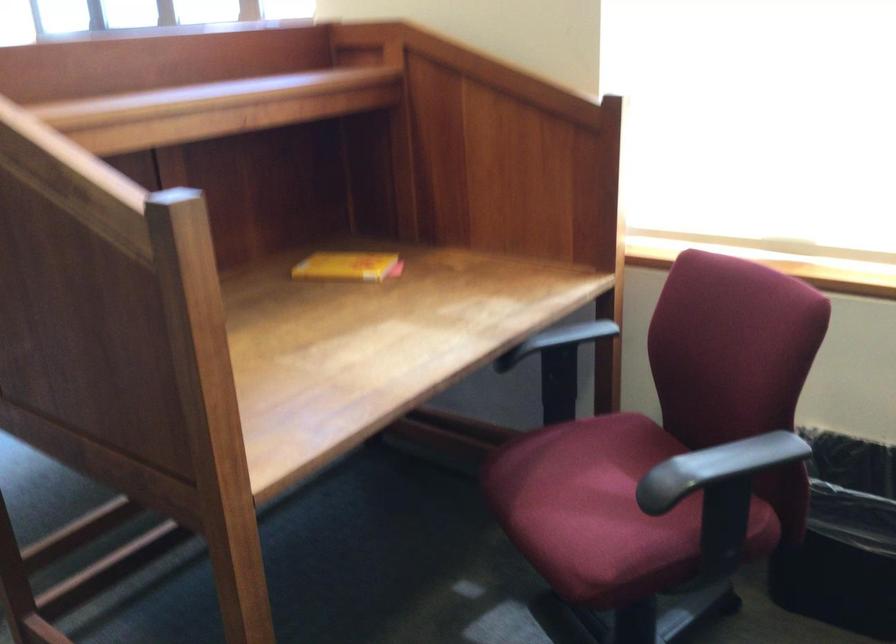
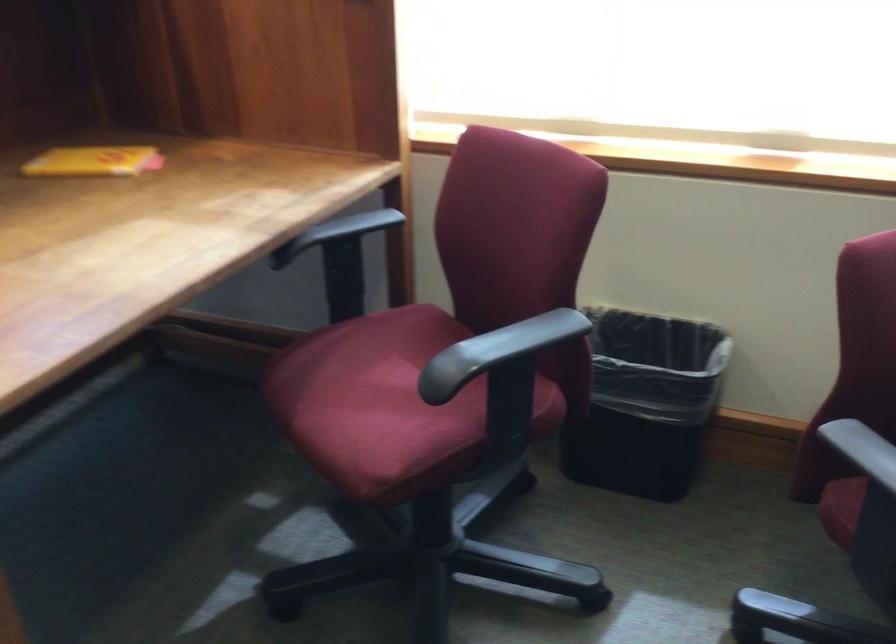
Question: How did the camera likely rotate?

Choices:
 (A) Left
 (B) Right
 (C) Up
 (D) Down

Answer: (B)